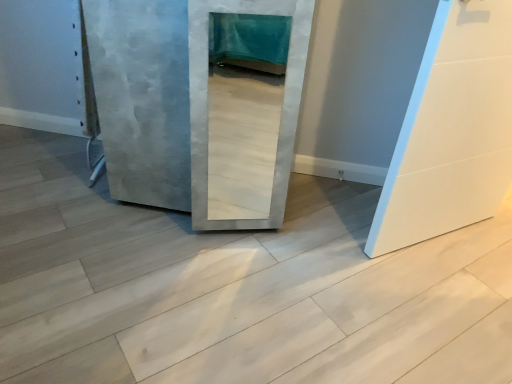
The image size is (512, 384). Identify the location of free space that is to the left of white matte door at right, placed as the 1th door when sorted from right to left. (330, 235).